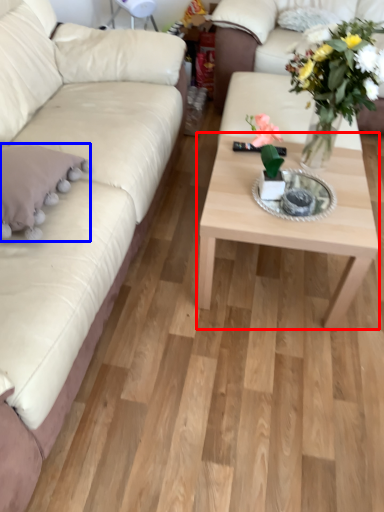
Question: Which point is further to the camera, coffee table (highlighted by a red box) or pillow (highlighted by a blue box)?

Choices:
 (A) coffee table
 (B) pillow

Answer: (A)